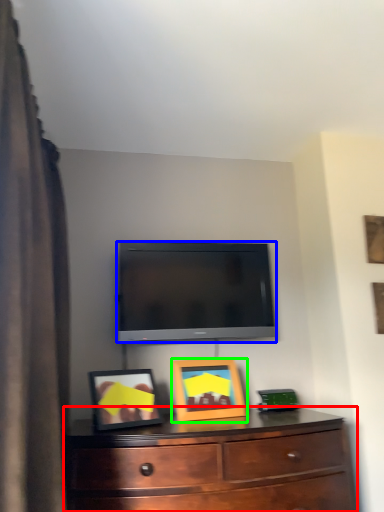
Question: Considering the real-world distances, which object is closest to chest of drawers (highlighted by a red box)? television (highlighted by a blue box) or picture frame (highlighted by a green box).

Choices:
 (A) television
 (B) picture frame

Answer: (B)